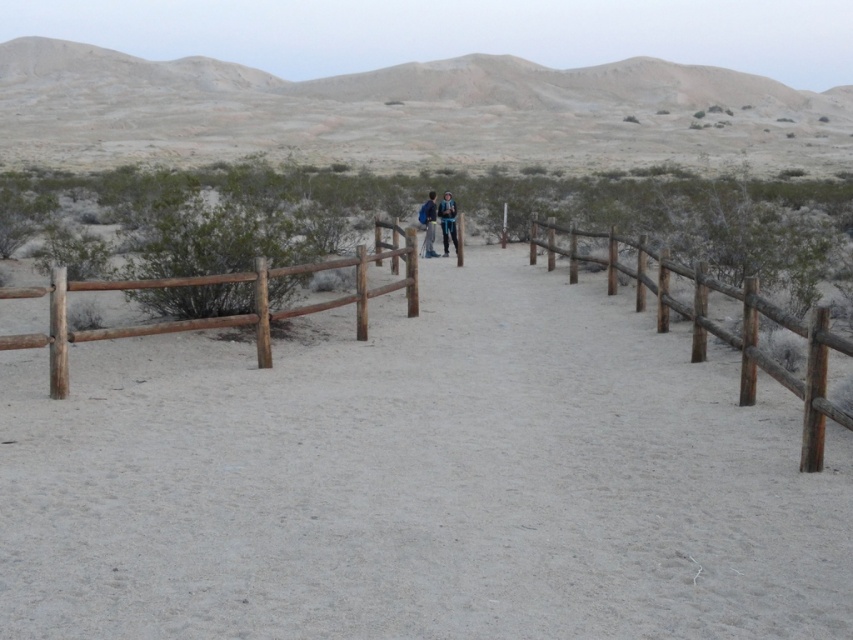
Where is `gray sand at center`? Image resolution: width=853 pixels, height=640 pixels. gray sand at center is located at coordinates (421, 480).

Between point (378, 310) and point (424, 234), which one is positioned in front?

Point (378, 310)

Where is `gray sand at center`? This screenshot has height=640, width=853. gray sand at center is located at coordinates (421, 480).

From the picture: Is the position of brown wooden fence at center less distant than that of brown wooden fence at left?

Yes, brown wooden fence at center is closer to the viewer.

Who is more forward, (531,260) or (286,273)?

Point (286,273) is more forward.

Does point (648, 253) come closer to viewer compared to point (100, 288)?

That is False.

What are the coordinates of `brown wooden fence at center` in the screenshot? It's located at (724, 328).

Is gray sand at center to the left of brown wooden fence at center from the viewer's perspective?

Yes, gray sand at center is to the left of brown wooden fence at center.

Is point (422, 632) positioned before point (813, 358)?

Yes, it is.

What do you see at coordinates (421, 480) in the screenshot? I see `gray sand at center` at bounding box center [421, 480].

I want to click on gray sand at center, so click(x=421, y=480).